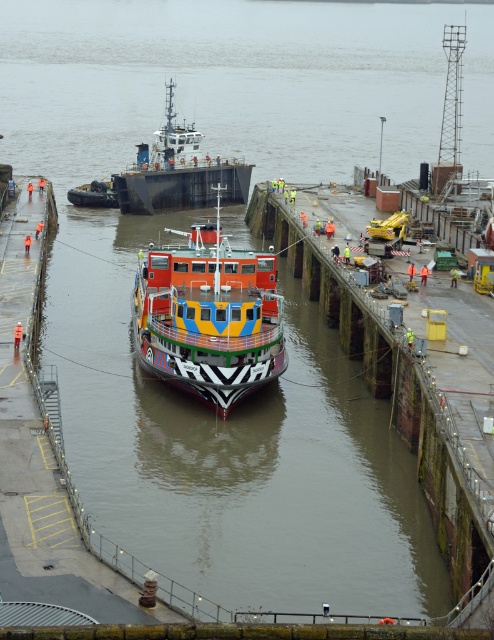
Which is below, multicolored painted ship at center or metallic gray barge at center?

multicolored painted ship at center is below.

Who is taller, multicolored painted ship at center or metallic gray barge at center?

multicolored painted ship at center is taller.

Describe the element at coordinates (208, 316) in the screenshot. I see `multicolored painted ship at center` at that location.

Locate an element on the screen. The height and width of the screenshot is (640, 494). multicolored painted ship at center is located at coordinates (208, 316).